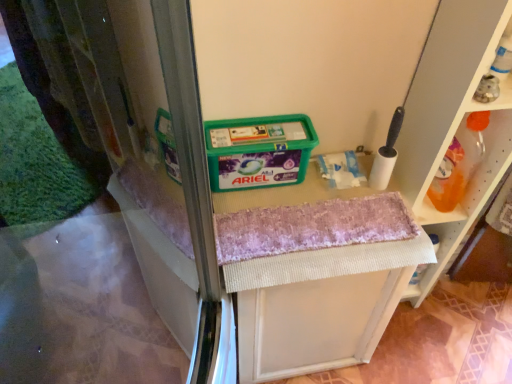
Question: From a real-world perspective, relative to white foam brush at upper right, is pink textured bath towel at center vertically above or below?

Choices:
 (A) below
 (B) above

Answer: (A)

Question: Considering the positions of pink textured bath towel at center and white foam brush at upper right in the image, is pink textured bath towel at center wider or thinner than white foam brush at upper right?

Choices:
 (A) thin
 (B) wide

Answer: (B)

Question: Which object is positioned closest to the textured fabric vanity at center?

Choices:
 (A) white foam brush at upper right
 (B) translucent plastic bottle at upper right, acting as the second shelf starting from the front
 (C) pink textured bath towel at center
 (D) white plastic shelf at right, which is counted as the first shelf, starting from the front

Answer: (C)

Question: Which object is the closest to the translucent plastic bottle at upper right, acting as the second shelf starting from the front?

Choices:
 (A) pink textured bath towel at center
 (B) white plastic shelf at right, arranged as the 2th shelf when viewed from the back
 (C) textured fabric vanity at center
 (D) white foam brush at upper right

Answer: (B)